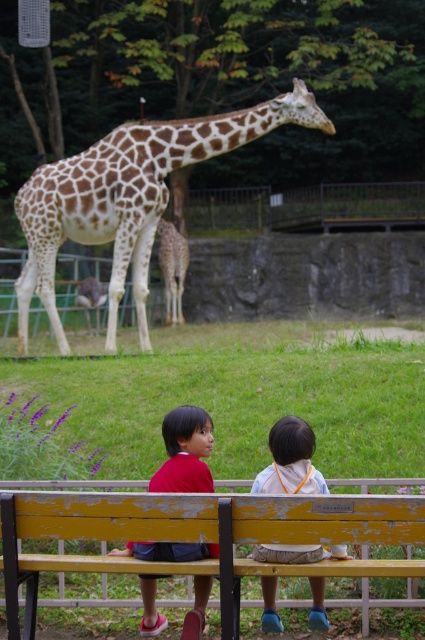
Question: Is spotted fur giraffe at upper center positioned before red fabric shirt at center?

Choices:
 (A) yes
 (B) no

Answer: (B)

Question: Which is farther from the red fabric shirt at center?

Choices:
 (A) wooden bench at center
 (B) light blue fabric shirt at center
 (C) spotted fur giraffe at center
 (D) spotted fur giraffe at upper center

Answer: (C)

Question: Does wooden bench at center appear over red fabric shirt at center?

Choices:
 (A) yes
 (B) no

Answer: (A)

Question: Does wooden bench at center appear under red fabric shirt at center?

Choices:
 (A) yes
 (B) no

Answer: (B)

Question: Which point is farther to the camera?

Choices:
 (A) wooden bench at center
 (B) light blue fabric shirt at center

Answer: (B)

Question: Estimate the real-world distances between objects in this image. Which object is closer to the wooden bench at center?

Choices:
 (A) spotted fur giraffe at upper center
 (B) spotted fur giraffe at center
 (C) light blue fabric shirt at center
 (D) red fabric shirt at center

Answer: (D)